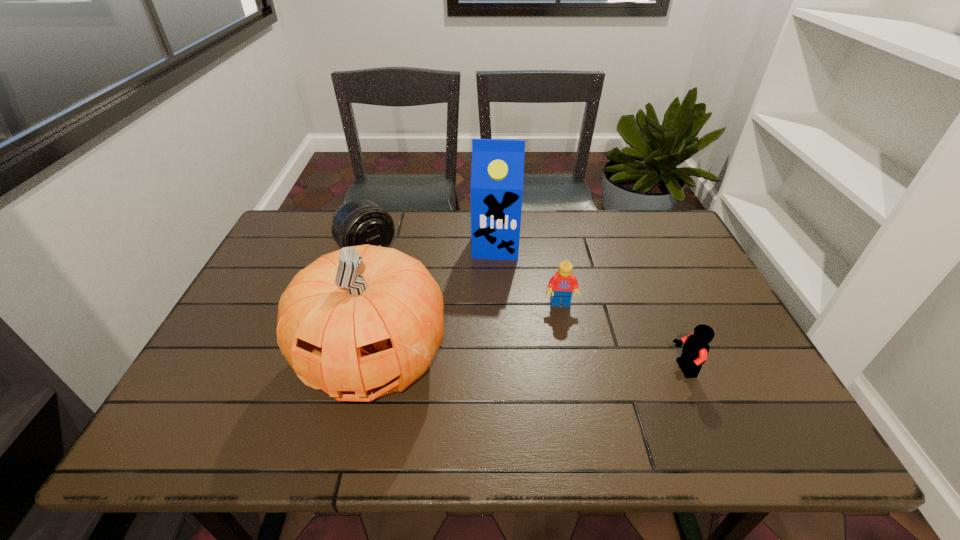
In order to click on vacant area located 0.380m with the cap open on the carton in this screenshot , I will do `click(488, 363)`.

The image size is (960, 540). Find the location of `vacant space situated 0.330m with the cap open on the carton`. vacant space situated 0.330m with the cap open on the carton is located at coordinates (489, 346).

This screenshot has height=540, width=960. Identify the location of vacant region located 0.370m with the cap open on the carton. (488, 359).

This screenshot has width=960, height=540. In order to click on free space located 0.150m on the face of the fourth object from left to right in this screenshot , I will do `click(567, 356)`.

At what (x,y) coordinates should I click in order to perform the action: click on free space located 0.190m on the face of the fourth object from left to right. Please return your answer as a coordinate pair (x, y). This screenshot has height=540, width=960. Looking at the image, I should click on (569, 370).

Where is `free space located on the face of the fourth object from left to right`? This screenshot has height=540, width=960. free space located on the face of the fourth object from left to right is located at coordinates (564, 340).

At what (x,y) coordinates should I click in order to perform the action: click on free space located 0.230m on the front-facing side of the third shortest object. Please return your answer as a coordinate pair (x, y). Looking at the image, I should click on [428, 307].

The width and height of the screenshot is (960, 540). What are the coordinates of `vacant space located on the front-facing side of the third shortest object` in the screenshot? It's located at (403, 284).

This screenshot has height=540, width=960. I want to click on vacant space located on the front-facing side of the third shortest object, so click(x=451, y=329).

You are a GUI agent. You are given a task and a screenshot of the screen. Output one action in this format:
    pyautogui.click(x=<x>, y=<y>)
    Task: Click on the carton that is at the far edge
    The image size is (960, 540).
    Given the screenshot: What is the action you would take?
    pyautogui.click(x=497, y=172)